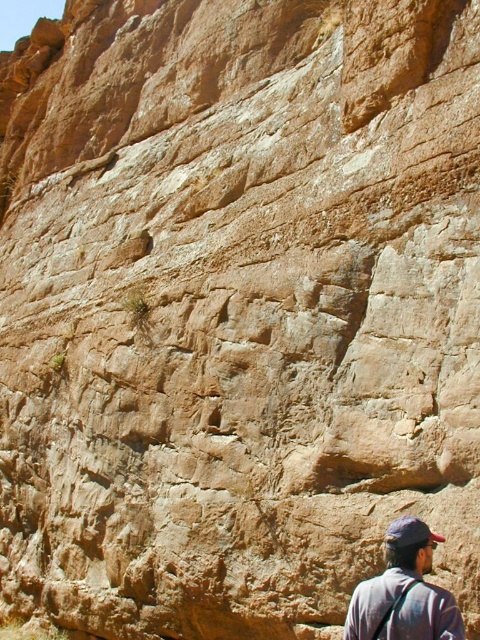
Between dark gray fabric cap at upper right and dark blue fabric baseball cap at lower right, which one is positioned lower?

Positioned lower is dark gray fabric cap at upper right.

Is point (395, 627) positioned before point (387, 544)?

That is True.

At what (x,y) coordinates should I click in order to perform the action: click on dark gray fabric cap at upper right. Please return your answer as a coordinate pair (x, y). The width and height of the screenshot is (480, 640). Looking at the image, I should click on (404, 592).